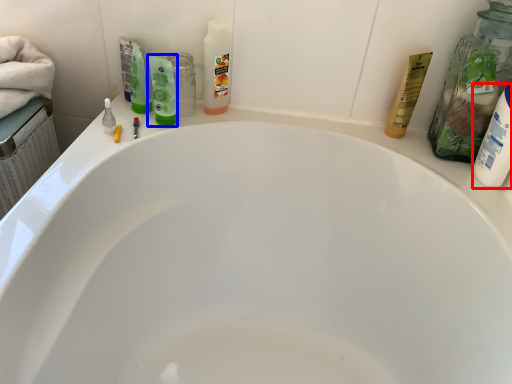
Question: Which of the following is the closest to the observer, toiletry (highlighted by a red box) or mouthwash (highlighted by a blue box)?

Choices:
 (A) toiletry
 (B) mouthwash

Answer: (A)